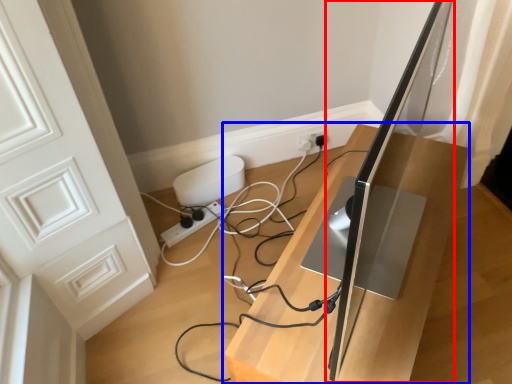
Question: Among these objects, which one is farthest to the camera, computer monitor (highlighted by a red box) or furniture (highlighted by a blue box)?

Choices:
 (A) computer monitor
 (B) furniture

Answer: (B)